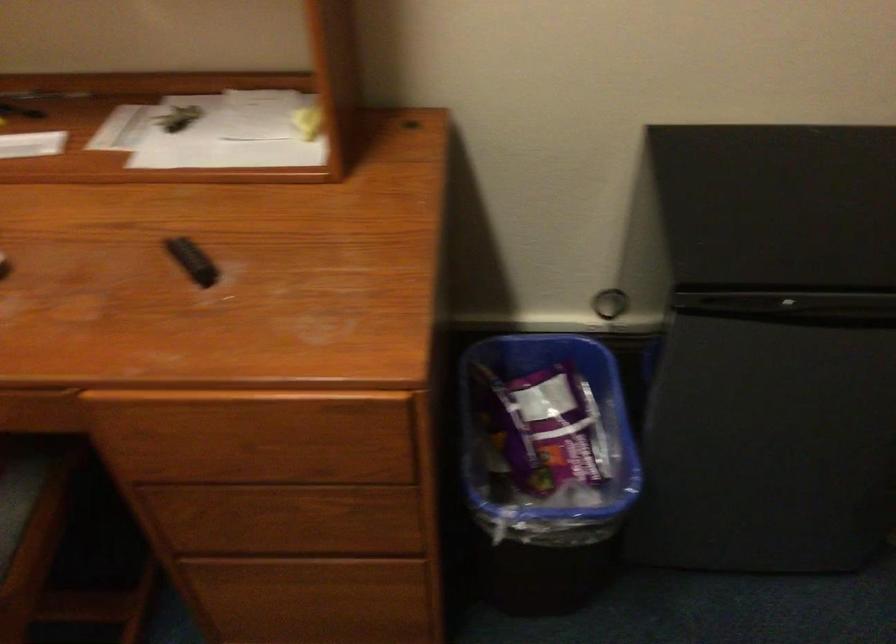
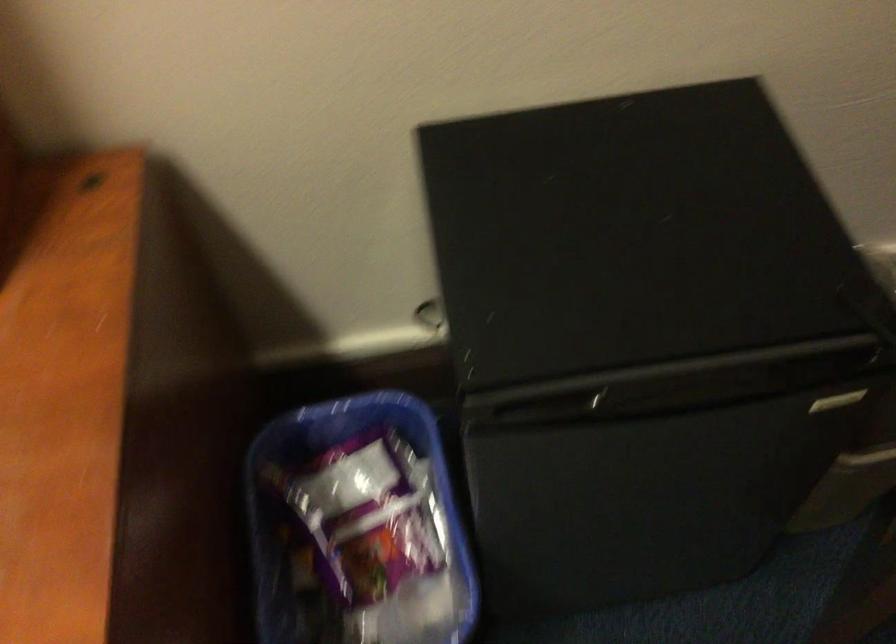
Question: The images are taken continuously from a first-person perspective. In which direction is your viewpoint rotating?

Choices:
 (A) Left
 (B) Right
 (C) Up
 (D) Down

Answer: (D)